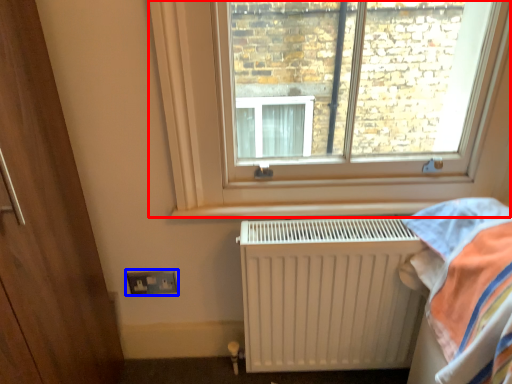
Question: Which object is closer to the camera taking this photo, window (highlighted by a red box) or electric outlet (highlighted by a blue box)?

Choices:
 (A) window
 (B) electric outlet

Answer: (A)